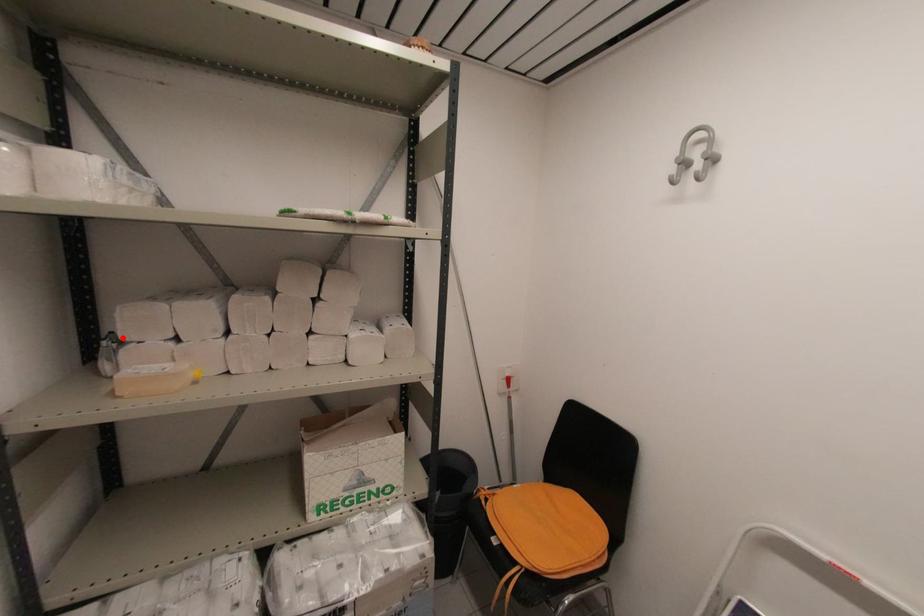
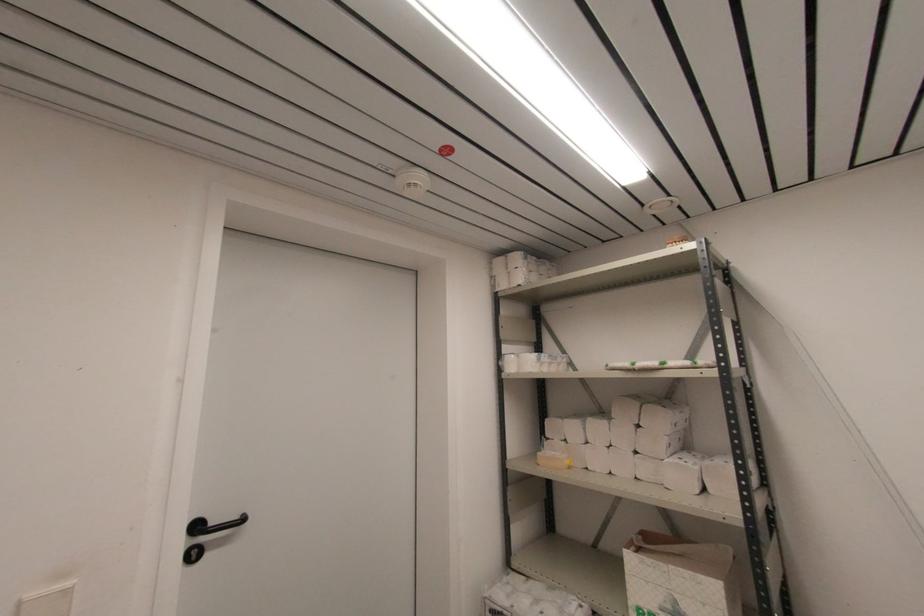
Question: I am providing you with two images of the same scene from different viewpoints. A red point is marked on the first image. Can you still see the location of the red point in image 2?

Choices:
 (A) Yes
 (B) No

Answer: (A)